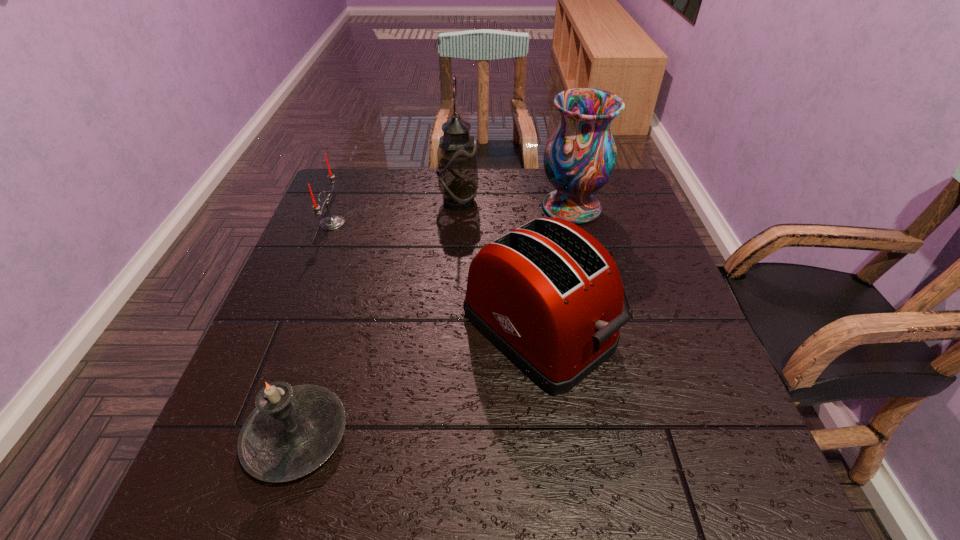
I want to click on oil lamp located in the far edge section of the desktop, so [x=457, y=169].

Find the location of a particular element. vase that is at the far edge is located at coordinates (579, 158).

You are a GUI agent. You are given a task and a screenshot of the screen. Output one action in this format:
    pyautogui.click(x=<x>, y=<y>)
    Task: Click on the candle that is at the far edge
    The height and width of the screenshot is (540, 960).
    Given the screenshot: What is the action you would take?
    pyautogui.click(x=332, y=222)

The width and height of the screenshot is (960, 540). What are the coordinates of `object present at the near edge` in the screenshot? It's located at (292, 431).

What are the coordinates of `object that is positioned at the right edge` in the screenshot? It's located at (579, 158).

Where is `object that is at the far left corner`? This screenshot has height=540, width=960. object that is at the far left corner is located at coordinates (332, 222).

The image size is (960, 540). Identify the location of object situated at the near left corner. (292, 431).

Identify the location of object that is at the far right corner. (579, 158).

Identify the location of vacant area at the far edge of the desktop. This screenshot has width=960, height=540. (523, 183).

Where is `free point at the near edge`? The image size is (960, 540). free point at the near edge is located at coordinates (565, 484).